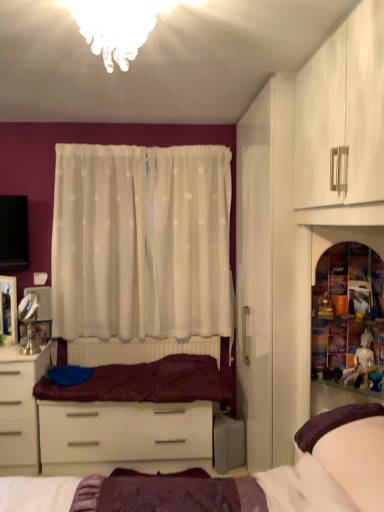
Question: Is point (124, 353) closer or farther from the camera than point (41, 352)?

Choices:
 (A) farther
 (B) closer

Answer: (A)

Question: From the image's perspective, is white glossy drawer at center above or below white glossy desk at lower left?

Choices:
 (A) above
 (B) below

Answer: (B)

Question: Considering the real-world distances, which object is farthest from the translucent glass chandelier at upper center?

Choices:
 (A) translucent glass shelf at right
 (B) silver/metallic makeup mirror at left
 (C) maroon velvet blanket at center
 (D) white sheer curtain at center
 (E) white glossy desk at lower left

Answer: (E)

Question: Which of these objects is positioned closest to the maroon velvet blanket at center?

Choices:
 (A) white glossy drawer at center
 (B) silver/metallic makeup mirror at left
 (C) translucent glass shelf at right
 (D) white sheer curtain at center
 (E) white glossy desk at lower left

Answer: (A)